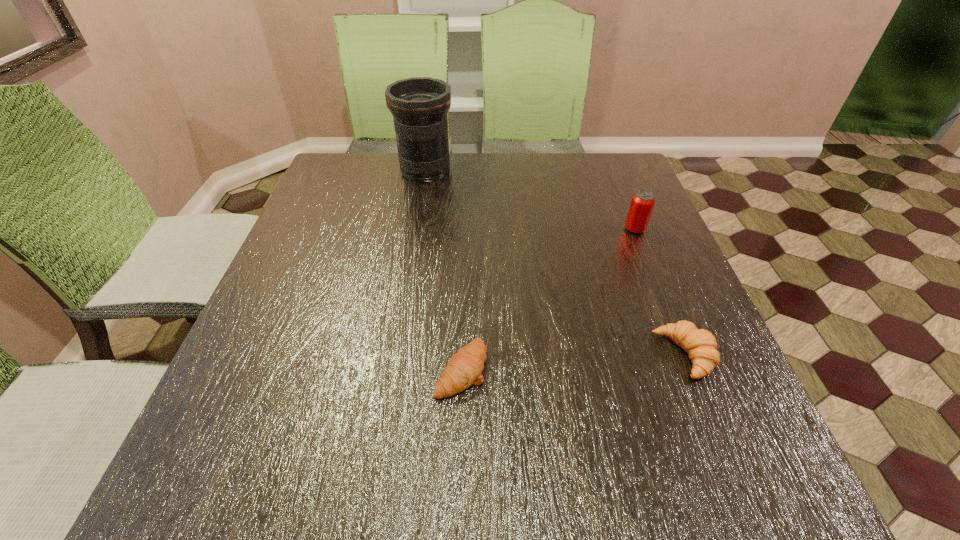
The image size is (960, 540). I want to click on object that is at the far edge, so click(x=419, y=105).

This screenshot has width=960, height=540. I want to click on can that is positioned at the right edge, so click(642, 203).

Identify the location of crescent roll present at the right edge. The image size is (960, 540). (700, 344).

You are a GUI agent. You are given a task and a screenshot of the screen. Output one action in this format:
    pyautogui.click(x=<x>, y=<y>)
    Task: Click on the free space at the far edge
    
    Given the screenshot: What is the action you would take?
    pyautogui.click(x=522, y=190)

Where is `vacant space at the near edge of the desktop`? The height and width of the screenshot is (540, 960). vacant space at the near edge of the desktop is located at coordinates (301, 471).

You are a GUI agent. You are given a task and a screenshot of the screen. Output one action in this format:
    pyautogui.click(x=<x>, y=<y>)
    Task: Click on the vacant space at the left edge of the desktop
    
    Given the screenshot: What is the action you would take?
    (324, 341)

Locate an element on the screen. The image size is (960, 540). free space at the right edge of the desktop is located at coordinates (616, 225).

Locate an element on the screen. vacant position at the far left corner of the desktop is located at coordinates (x=349, y=169).

Find the location of `free space at the far right corner of the desktop`. free space at the far right corner of the desktop is located at coordinates (629, 187).

The height and width of the screenshot is (540, 960). Find the location of `unoccupied area between the telephoto lens and the second farthest object`. unoccupied area between the telephoto lens and the second farthest object is located at coordinates (530, 200).